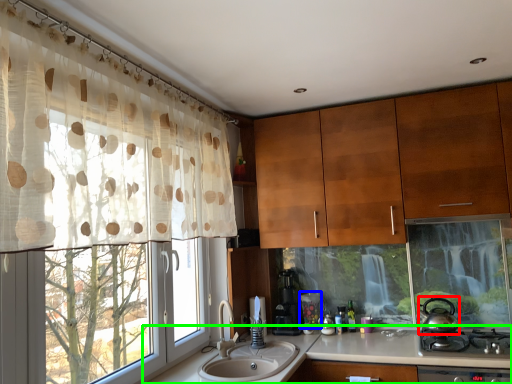
Question: Which object is the farthest from tea pot (highlighted by a red box)? Choose among these: appliance (highlighted by a blue box) or countertop (highlighted by a green box).

Choices:
 (A) appliance
 (B) countertop

Answer: (A)